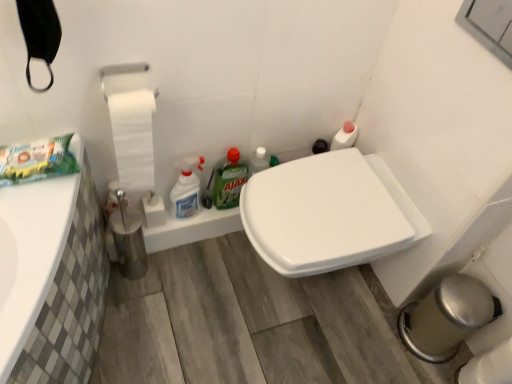
Question: From the image's perspective, is green matte ajax at center, the first cleaning product when ordered from right to left, above or below white glossy spray bottle at center, arranged as the second cleaning product when viewed from the right?

Choices:
 (A) above
 (B) below

Answer: (A)

Question: Is green matte ajax at center, arranged as the 2th cleaning product when viewed from the left, to the left or to the right of white glossy spray bottle at center, arranged as the second cleaning product when viewed from the right, in the image?

Choices:
 (A) right
 (B) left

Answer: (A)

Question: Which object is the farthest from the green matte ajax at center, arranged as the 2th cleaning product when viewed from the left?

Choices:
 (A) white matte toilet paper at left
 (B) white glossy toilet seat at center
 (C) white glossy spray bottle at center, arranged as the second cleaning product when viewed from the right

Answer: (B)

Question: Which object is the closest to the white glossy spray bottle at center, the first cleaning product in the left-to-right sequence?

Choices:
 (A) white glossy toilet seat at center
 (B) green matte ajax at center, the first cleaning product when ordered from right to left
 (C) white matte toilet paper at left

Answer: (B)